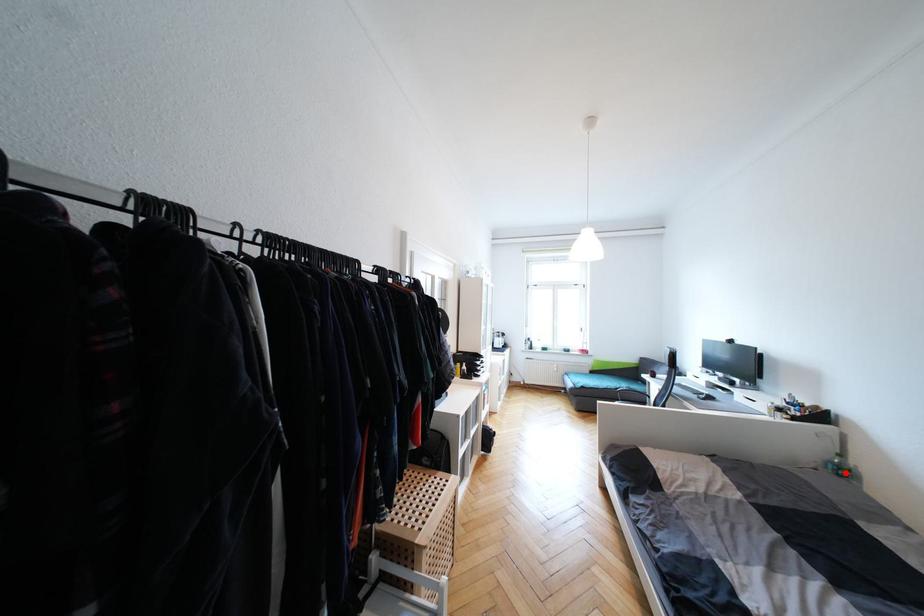
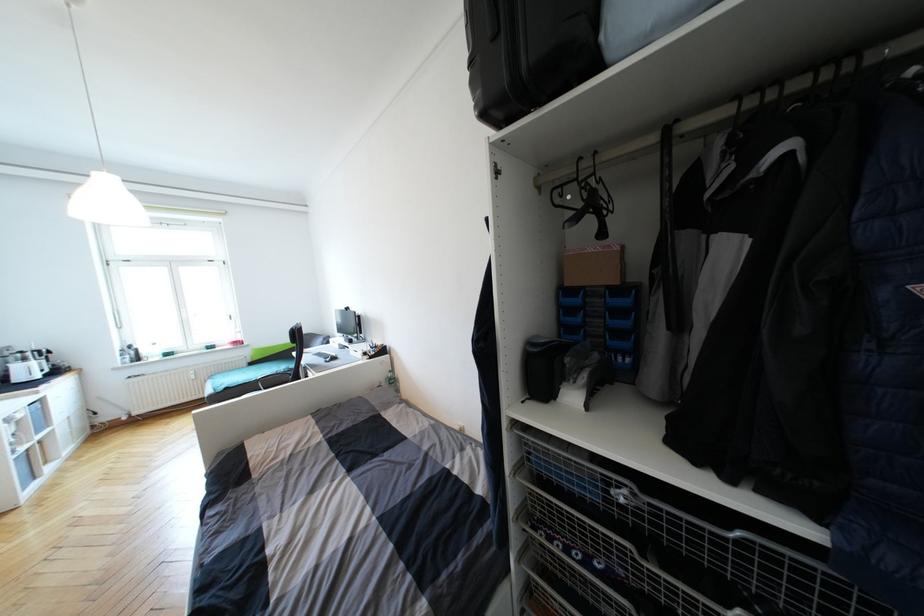
The point at the highlighted location is marked in the first image. Where is the corresponding point in the second image?

(395, 382)